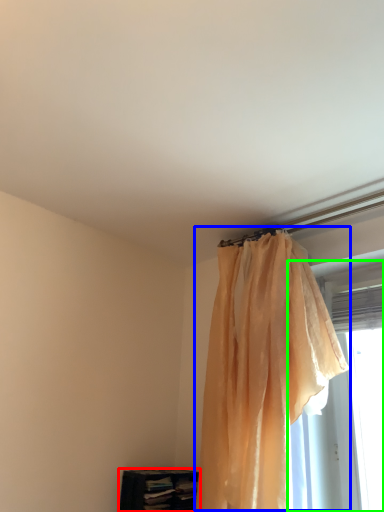
Question: Which is nearer to the furniture (highlighted by a red box)? curtain (highlighted by a blue box) or window (highlighted by a green box).

Choices:
 (A) curtain
 (B) window

Answer: (A)